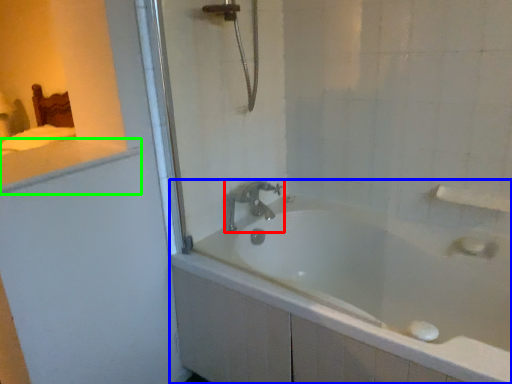
Question: Which is farther away from tap (highlighted by a red box)? bathtub (highlighted by a blue box) or counter top (highlighted by a green box)?

Choices:
 (A) bathtub
 (B) counter top

Answer: (B)